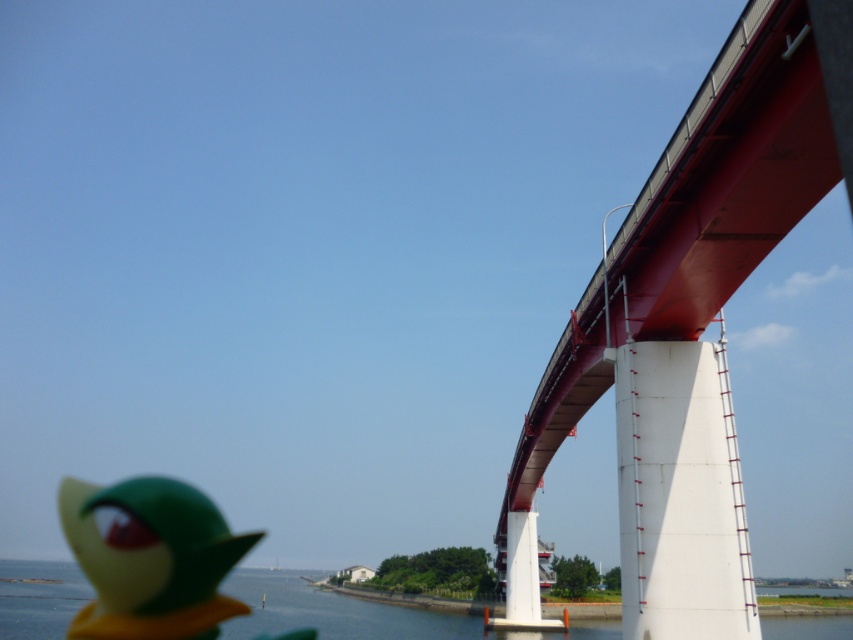
Is matte green rubber duck at lower left taller than blue water at lower left?

In fact, matte green rubber duck at lower left may be shorter than blue water at lower left.

Which is behind, point (158, 600) or point (575, 627)?

The point (158, 600) is more distant.

Identify the location of matte green rubber duck at lower left. This screenshot has height=640, width=853. click(149, 557).

Which is more to the left, red painted steel bridge at right or blue water at lower left?

From the viewer's perspective, blue water at lower left appears more on the left side.

Can you confirm if red painted steel bridge at right is shorter than blue water at lower left?

Yes.

Is point (642, 541) positioned in front of point (804, 628)?

Yes, it is.

I want to click on red painted steel bridge at right, so click(692, 317).

Looking at this image, can you confirm if red painted steel bridge at right is shorter than matte green rubber duck at lower left?

No, red painted steel bridge at right is not shorter than matte green rubber duck at lower left.

Does point (614, 401) come farther from viewer compared to point (230, 604)?

No, (614, 401) is in front of (230, 604).

Find the location of a particular element. red painted steel bridge at right is located at coordinates (692, 317).

Find the location of a particular element. red painted steel bridge at right is located at coordinates (692, 317).